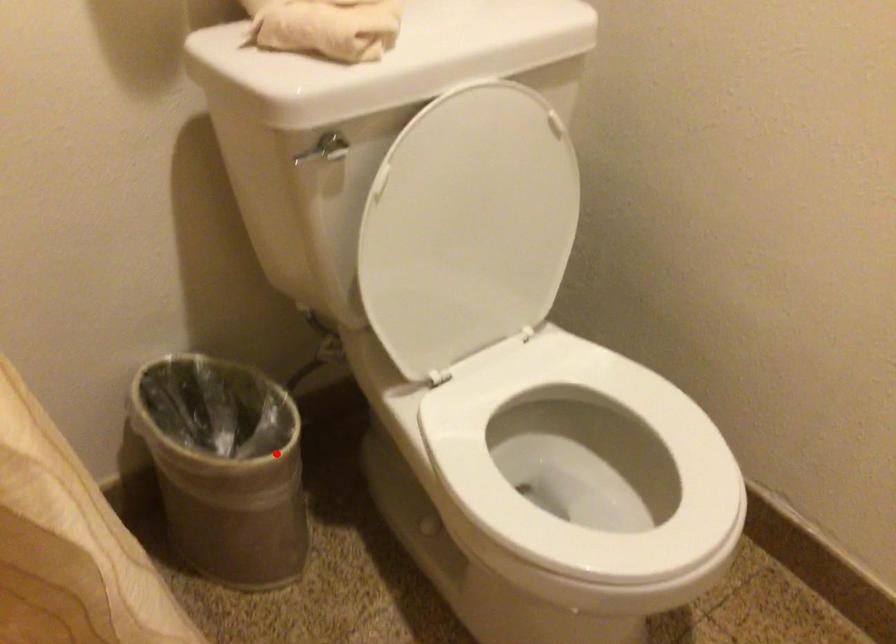
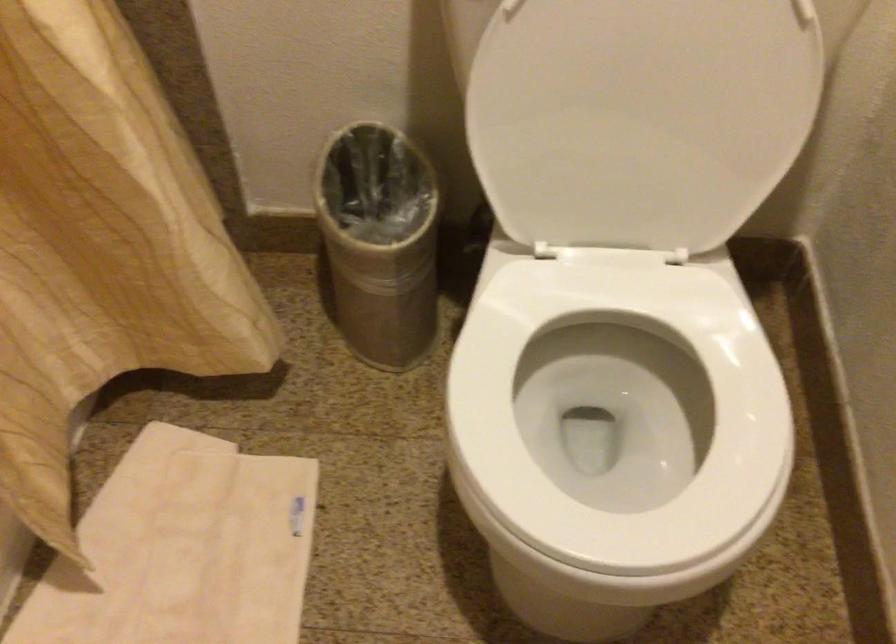
Locate, in the second image, the point that corresponds to the highlighted location in the first image.

(380, 242)